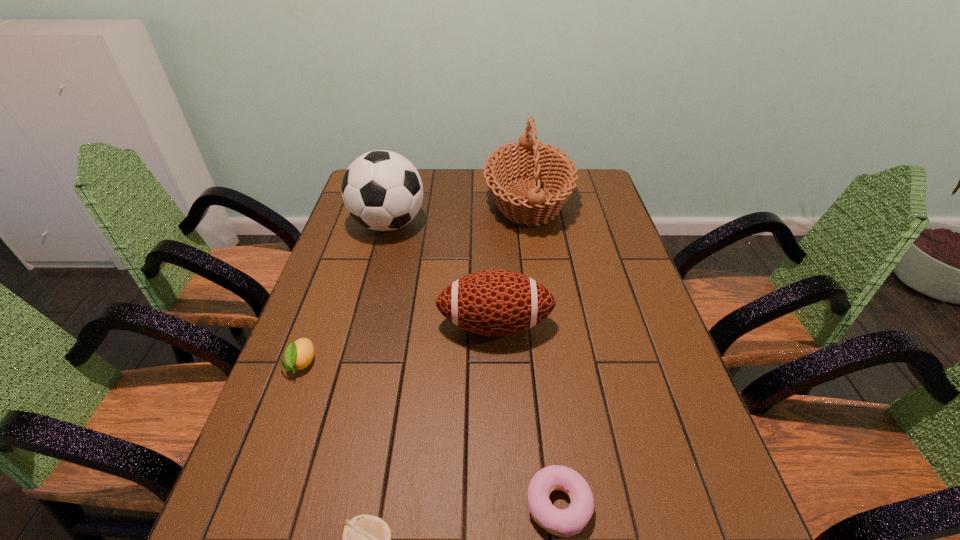
At what (x,y) coordinates should I click in order to perform the action: click on basket. Please return your answer as a coordinate pair (x, y). This screenshot has height=540, width=960. Looking at the image, I should click on (528, 158).

This screenshot has height=540, width=960. Find the location of `soccer ball`. soccer ball is located at coordinates (382, 190).

Find the location of a particular element. the fourth shortest object is located at coordinates (495, 302).

Locate an element on the screen. the taller lemon is located at coordinates (299, 354).

At what (x,y) coordinates should I click in order to perform the action: click on the left lemon. Please return your answer as a coordinate pair (x, y). This screenshot has height=540, width=960. Looking at the image, I should click on (299, 354).

This screenshot has width=960, height=540. Identify the location of free space located 0.300m on the front of the basket. [544, 309].

Locate an element on the screen. free space located on the right of the soccer ball is located at coordinates (515, 224).

Locate an element on the screen. vacant region located 0.180m on the left of the football is located at coordinates pyautogui.click(x=367, y=325).

At what (x,y) coordinates should I click in order to perform the action: click on vacant space located 0.120m with leaves positioned above the third shortest object. Please return your answer as a coordinate pair (x, y). Image resolution: width=960 pixels, height=540 pixels. Looking at the image, I should click on (276, 430).

Image resolution: width=960 pixels, height=540 pixels. Identify the location of object that is at the far edge. [x=528, y=158].